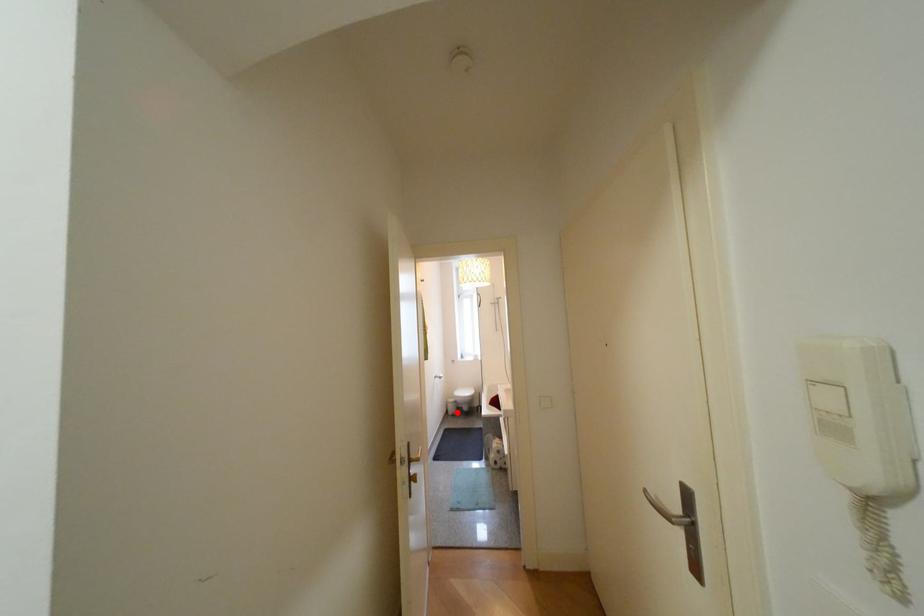
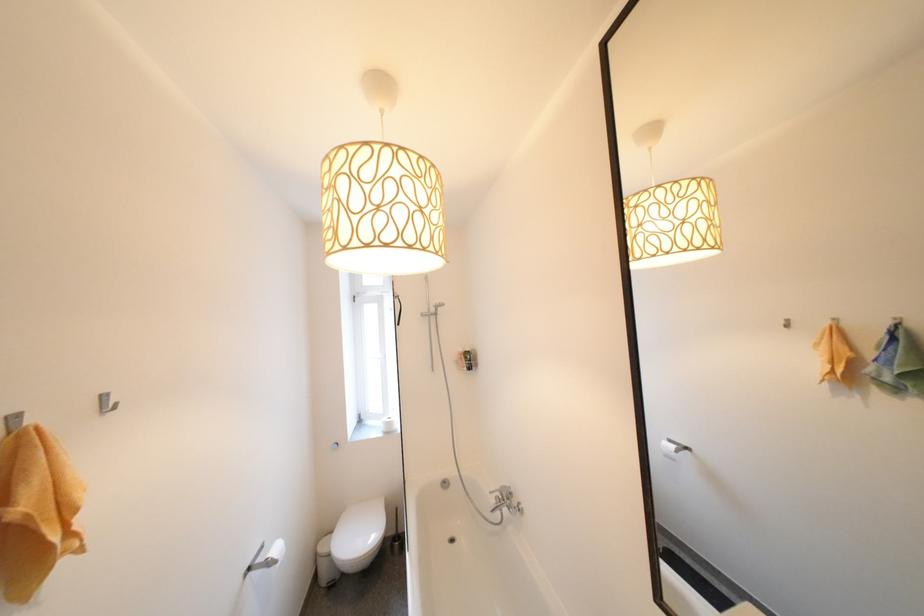
Question: A red point is marked in image1. In image2, is the corresponding 3D point closer to the camera or farther? Reply with the corresponding letter.

Choices:
 (A) The corresponding 3D point is closer.
 (B) The corresponding 3D point is farther.

Answer: (A)